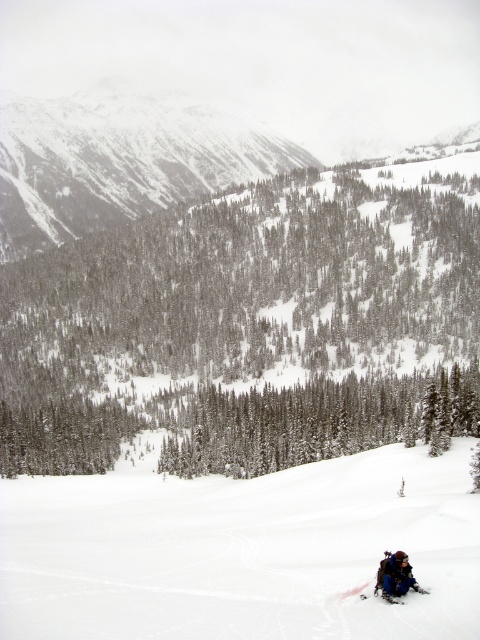
Can you confirm if snow-covered evergreen tree at center is thinner than snowy rocky mountain at upper left?

Indeed, snow-covered evergreen tree at center has a lesser width compared to snowy rocky mountain at upper left.

Does snow-covered evergreen tree at center have a larger size compared to snowy rocky mountain at upper left?

Incorrect, snow-covered evergreen tree at center is not larger than snowy rocky mountain at upper left.

The width and height of the screenshot is (480, 640). What are the coordinates of `snow-covered evergreen tree at center` in the screenshot? It's located at (250, 324).

Between point (464, 273) and point (334, 618), which one is positioned in front?

Point (334, 618) is more forward.

Image resolution: width=480 pixels, height=640 pixels. I want to click on snow-covered evergreen tree at center, so click(250, 324).

Describe the element at coordinates (242, 552) in the screenshot. This screenshot has width=480, height=640. I see `white snow ski slope at lower right` at that location.

Which is above, white snow ski slope at lower right or snowy rocky mountain at upper left?

Positioned higher is snowy rocky mountain at upper left.

Is point (11, 600) in front of point (115, 170)?

Yes.

The height and width of the screenshot is (640, 480). In order to click on white snow ski slope at lower right in this screenshot , I will do pos(242,552).